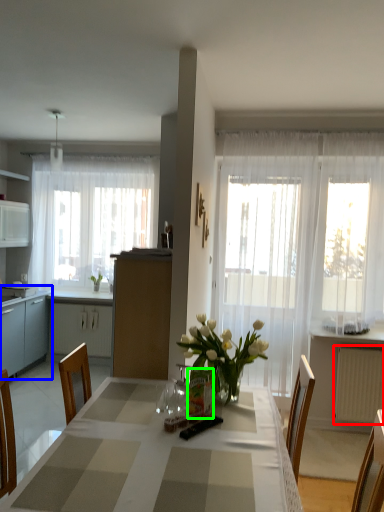
Question: Which is farther away from radiator (highlighted by a red box)? cabinetry (highlighted by a blue box) or vase (highlighted by a green box)?

Choices:
 (A) cabinetry
 (B) vase

Answer: (A)